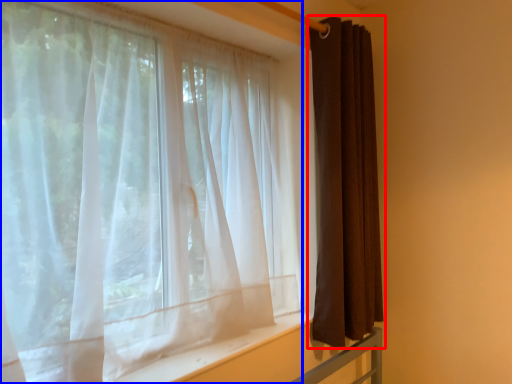
Question: Among these objects, which one is farthest to the camera, curtain (highlighted by a red box) or curtain (highlighted by a blue box)?

Choices:
 (A) curtain
 (B) curtain

Answer: (A)